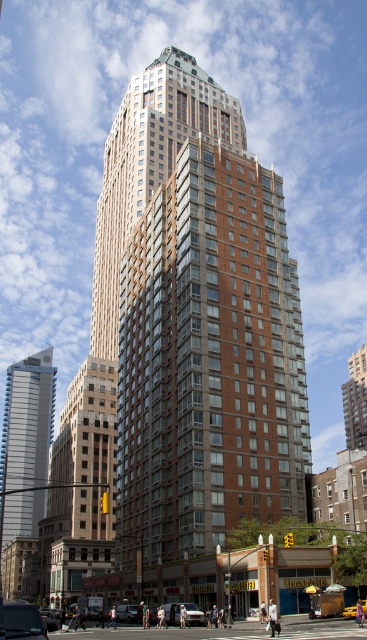
From the picture: You are a parking attendant trying to fit a truck that is 2 meters wide into the space between the shiny black car at lower left and the silver metallic car at lower center. Based on their widths, can the truck fit between them?

The shiny black car at lower left might be wider than silver metallic car at lower center, so the total width available between them is uncertain. Without knowing the exact widths of both cars, it is not possible to determine if the truck will fit.

Based on the photo, you are standing on the sidewalk in front of the brown brick building at center and want to walk to the silver metallic car at lower center. Which direction should you walk to get closer to the car?

Since the brown brick building at center is closer to you than the silver metallic car at lower center, you should walk forward away from the building towards the car.